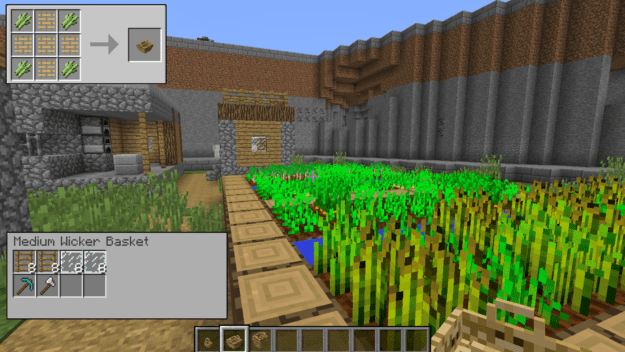
At what (x,y) coordinates should I click in order to perform the action: click on basket. Please return your answer as a coordinate pair (x, y). Image resolution: width=625 pixels, height=352 pixels. Looking at the image, I should click on (122, 241).